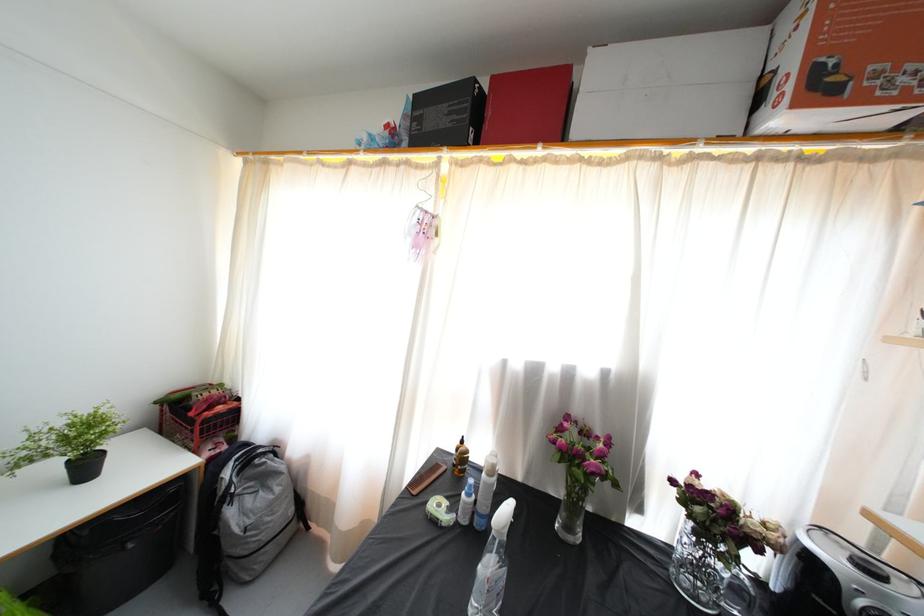
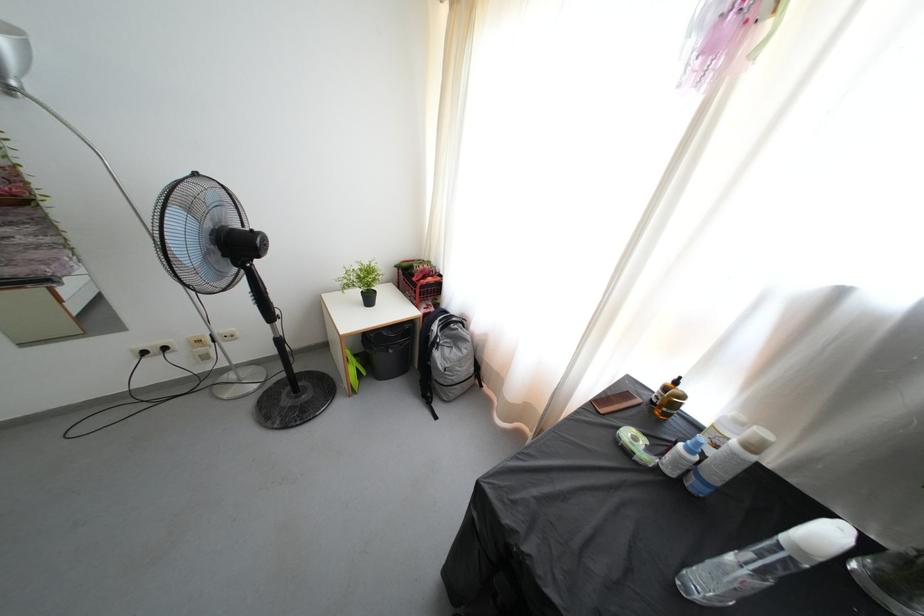
Locate, in the second image, the point that corresponds to the point at 574,533 in the first image.

(894, 592)